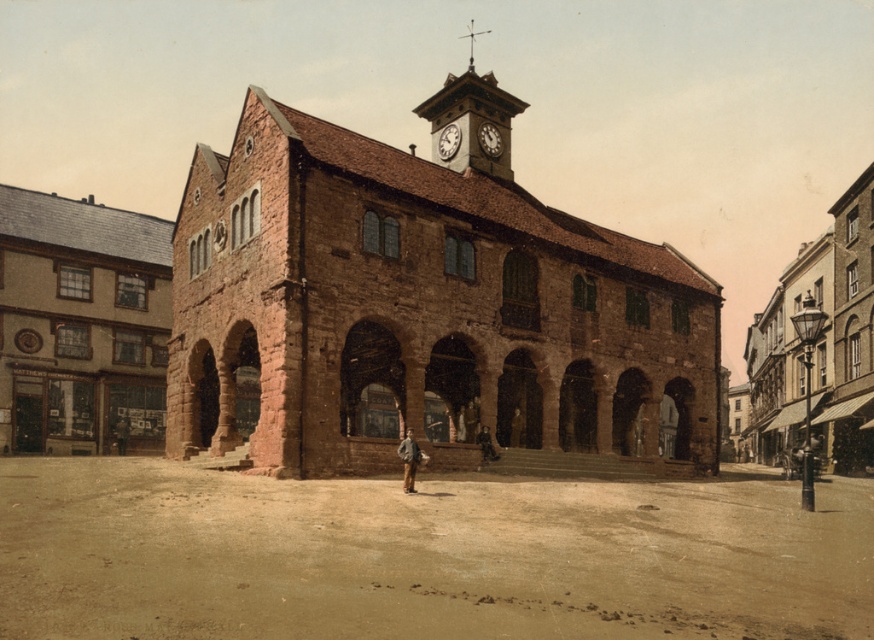
From the picture: Is white textured clock at upper center positioned behind matte brown clock at upper center?

No, it is in front of matte brown clock at upper center.

Which is below, white textured clock at upper center or matte brown clock at upper center?

white textured clock at upper center

Measure the distance between white textured clock at upper center and camera.

88.34 meters

At what (x,y) coordinates should I click in order to perform the action: click on white textured clock at upper center. Please return your answer as a coordinate pair (x, y). Looking at the image, I should click on (448, 140).

Does green stone clock tower at upper center have a smaller size compared to white textured clock at upper center?

Incorrect, green stone clock tower at upper center is not smaller in size than white textured clock at upper center.

This screenshot has height=640, width=874. Describe the element at coordinates (470, 122) in the screenshot. I see `green stone clock tower at upper center` at that location.

At what (x,y) coordinates should I click in order to perform the action: click on green stone clock tower at upper center. Please return your answer as a coordinate pair (x, y). Looking at the image, I should click on (470, 122).

Who is positioned more to the right, green stone clock tower at upper center or matte brown clock at upper center?

Positioned to the right is green stone clock tower at upper center.

Can you confirm if green stone clock tower at upper center is positioned to the left of matte brown clock at upper center?

No, green stone clock tower at upper center is not to the left of matte brown clock at upper center.

The width and height of the screenshot is (874, 640). In order to click on green stone clock tower at upper center in this screenshot , I will do `click(470, 122)`.